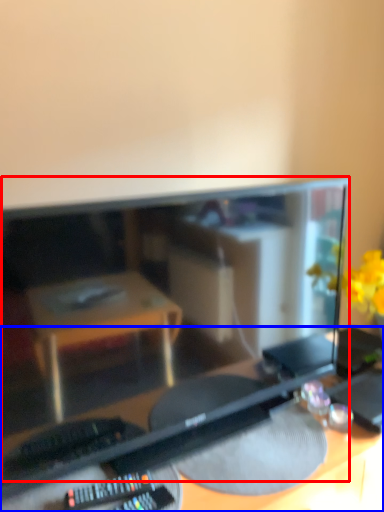
Question: Among these objects, which one is farthest to the camera, computer monitor (highlighted by a red box) or desk (highlighted by a blue box)?

Choices:
 (A) computer monitor
 (B) desk

Answer: (A)